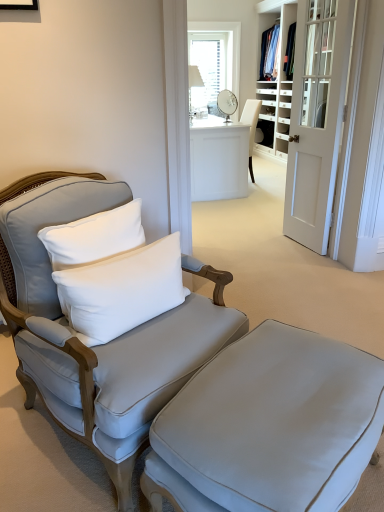
Question: Is the depth of satin gray armchair at left less than that of white glass window at upper center?

Choices:
 (A) no
 (B) yes

Answer: (B)

Question: Is satin gray armchair at left oriented towards white glass window at upper center?

Choices:
 (A) yes
 (B) no

Answer: (B)

Question: Can you confirm if satin gray armchair at left is thinner than white glass window at upper center?

Choices:
 (A) yes
 (B) no

Answer: (B)

Question: Is satin gray armchair at left taller than white glass window at upper center?

Choices:
 (A) no
 (B) yes

Answer: (A)

Question: From the image's perspective, is satin gray armchair at left beneath white glass window at upper center?

Choices:
 (A) no
 (B) yes

Answer: (B)

Question: Considering the positions of matte gray ottoman at lower center and white wood bookshelf at center in the image, is matte gray ottoman at lower center taller or shorter than white wood bookshelf at center?

Choices:
 (A) short
 (B) tall

Answer: (A)

Question: In terms of width, does matte gray ottoman at lower center look wider or thinner when compared to white wood bookshelf at center?

Choices:
 (A) thin
 (B) wide

Answer: (B)

Question: Does point (157, 441) appear closer or farther from the camera than point (278, 89)?

Choices:
 (A) farther
 (B) closer

Answer: (B)

Question: Would you say matte gray ottoman at lower center is to the left or to the right of white wood bookshelf at center in the picture?

Choices:
 (A) left
 (B) right

Answer: (A)

Question: Is white glossy desk at center bigger or smaller than white soft cushion at left?

Choices:
 (A) small
 (B) big

Answer: (B)

Question: Is point (226, 154) closer or farther from the camera than point (155, 268)?

Choices:
 (A) closer
 (B) farther

Answer: (B)

Question: Relative to white soft cushion at left, is white glossy desk at center in front or behind?

Choices:
 (A) behind
 (B) front

Answer: (A)

Question: Would you say white glossy desk at center is to the left or to the right of white soft cushion at left in the picture?

Choices:
 (A) left
 (B) right

Answer: (B)

Question: Is white glass window at upper center taller or shorter than satin gray armchair at left?

Choices:
 (A) tall
 (B) short

Answer: (A)

Question: Looking at the image, does white glass window at upper center seem bigger or smaller compared to satin gray armchair at left?

Choices:
 (A) small
 (B) big

Answer: (A)